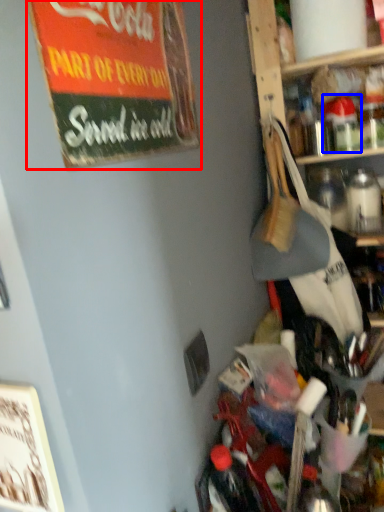
Question: Which point is further to the camera, bulletin board (highlighted by a red box) or bottle (highlighted by a blue box)?

Choices:
 (A) bulletin board
 (B) bottle

Answer: (B)